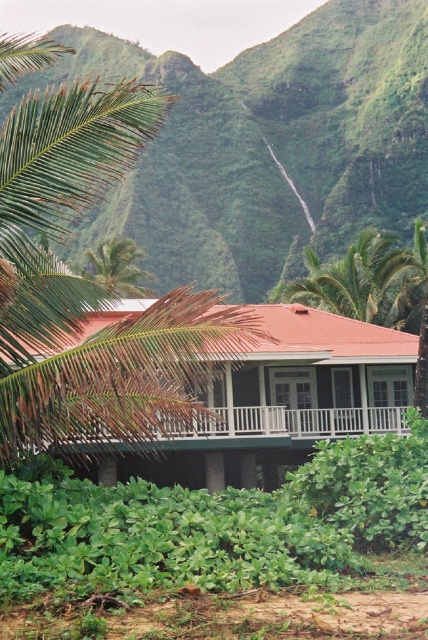
You are standing in front of the house and want to take a photo of the white wooden porch at center without the green leafy palm tree at upper left blocking the view. Is the porch visible from your current position?

The white wooden porch at center is in front of the green leafy palm tree at upper left, so yes, the porch is visible without obstruction from the palm tree.

You are standing in front of the two story house with a red tiled roof and white railings. You see a green leafy palm tree at center and a white wooden porch at center. Which object is positioned to the right of the other?

The green leafy palm tree at center is to the right of the white wooden porch at center.